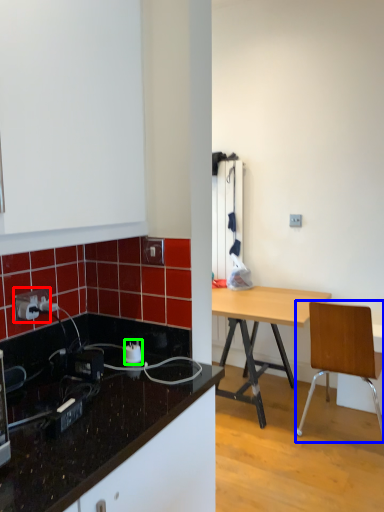
Question: Estimate the real-world distances between objects in this image. Which object is farther from power outlet (highlighted by a red box), chair (highlighted by a blue box) or power plugs and sockets (highlighted by a green box)?

Choices:
 (A) chair
 (B) power plugs and sockets

Answer: (A)